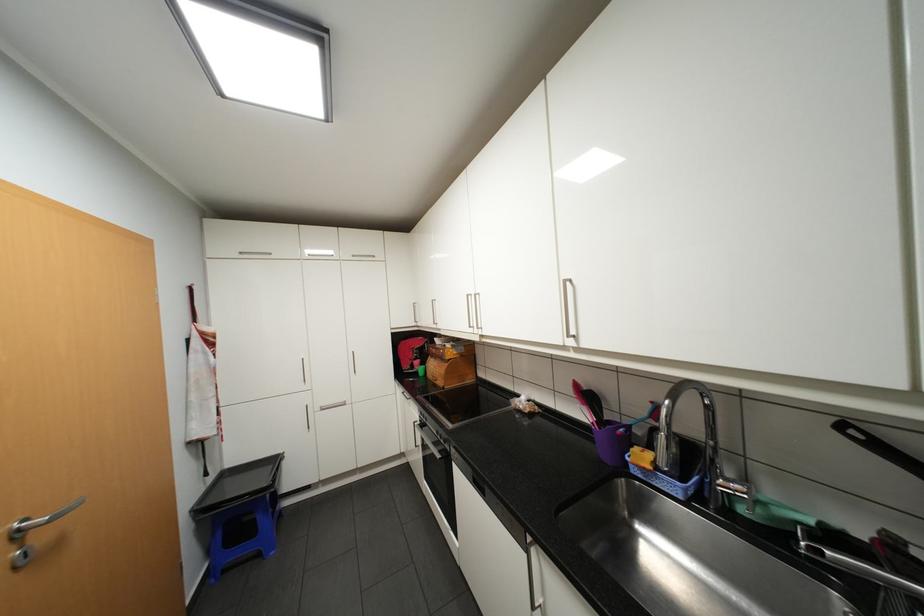
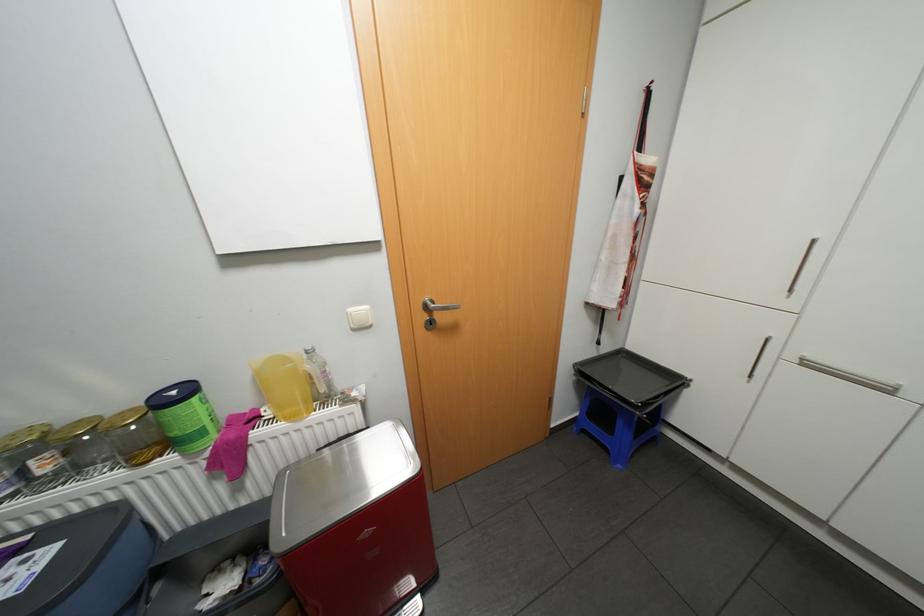
In the second image, find the point that corresponds to point 233,570 in the first image.

(591, 431)